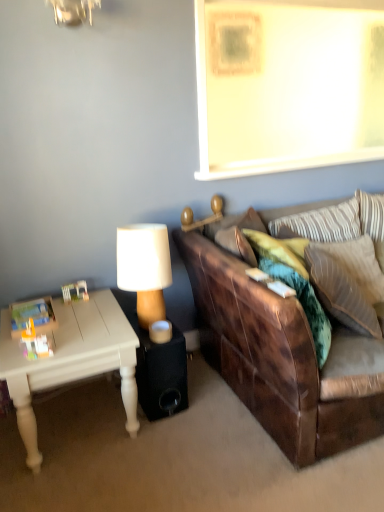
At what (x,y) coordinates should I click in order to perform the action: click on free space above white painted wood coffee table at lower left (from a real-world perspective). Please return your answer as a coordinate pair (x, y). Looking at the image, I should click on (65, 326).